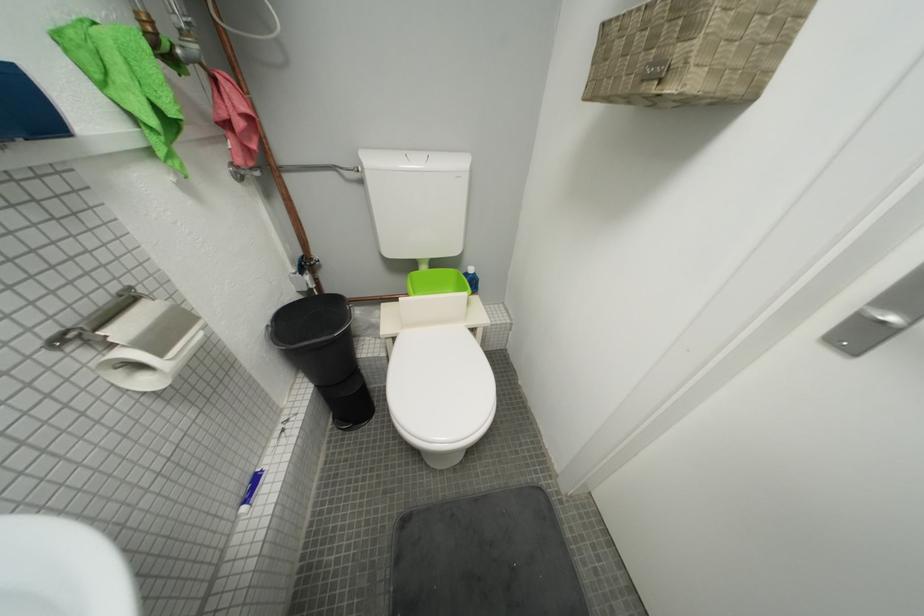
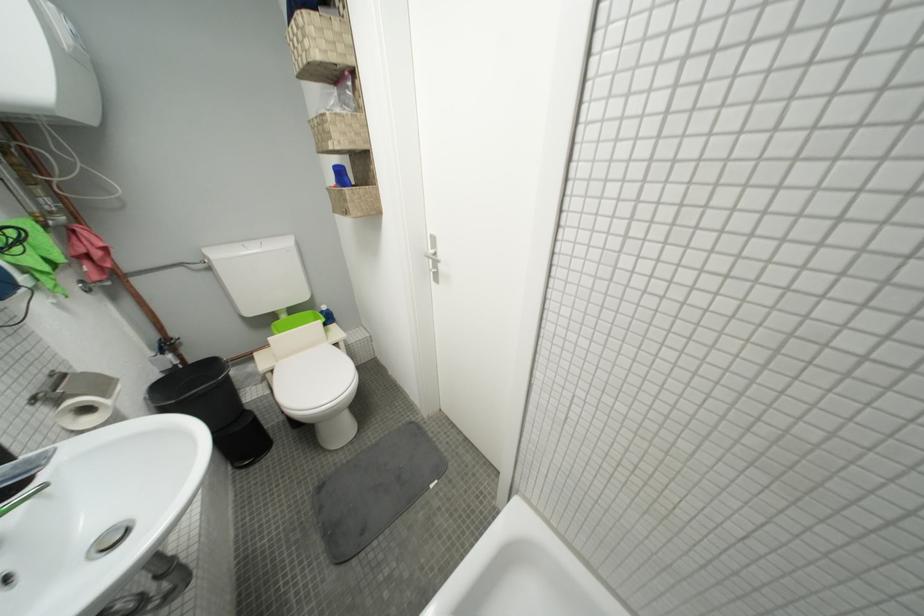
Find the pixel in the second image that matches pixel 169 357 in the first image.

(113, 397)